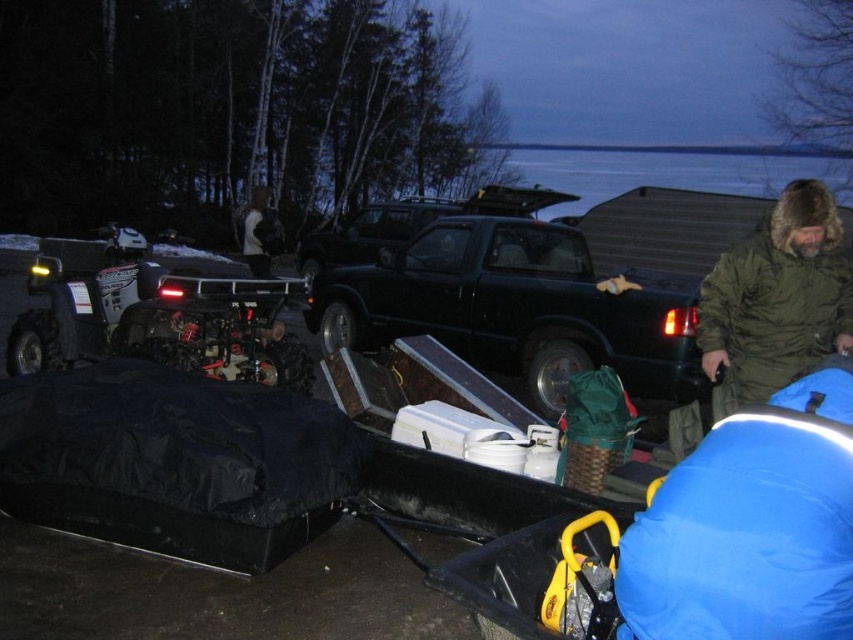
Question: Among these objects, which one is nearest to the camera?

Choices:
 (A) dark brown fur coat at upper center
 (B) black matte quad bike at left

Answer: (B)

Question: Which object appears farthest from the camera in this image?

Choices:
 (A) black matte quad bike at left
 (B) black matte truck at center
 (C) dark brown fur coat at upper center
 (D) green fuzzy coat at right

Answer: (C)

Question: Which object is farther from the camera taking this photo?

Choices:
 (A) black matte quad bike at left
 (B) black matte truck at center
 (C) green fuzzy coat at right
 (D) dark brown fur coat at upper center

Answer: (D)

Question: Is black matte truck at center closer to the viewer compared to dark brown fur coat at upper center?

Choices:
 (A) no
 (B) yes

Answer: (B)

Question: Does black matte quad bike at left appear under green fuzzy coat at right?

Choices:
 (A) yes
 (B) no

Answer: (B)

Question: Is green fuzzy coat at right further to camera compared to dark brown fur coat at upper center?

Choices:
 (A) yes
 (B) no

Answer: (B)